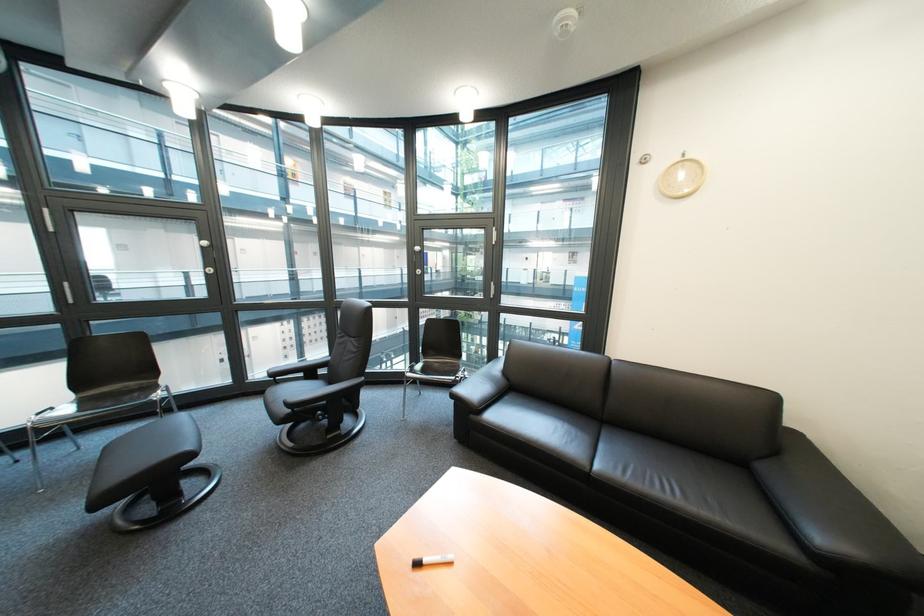
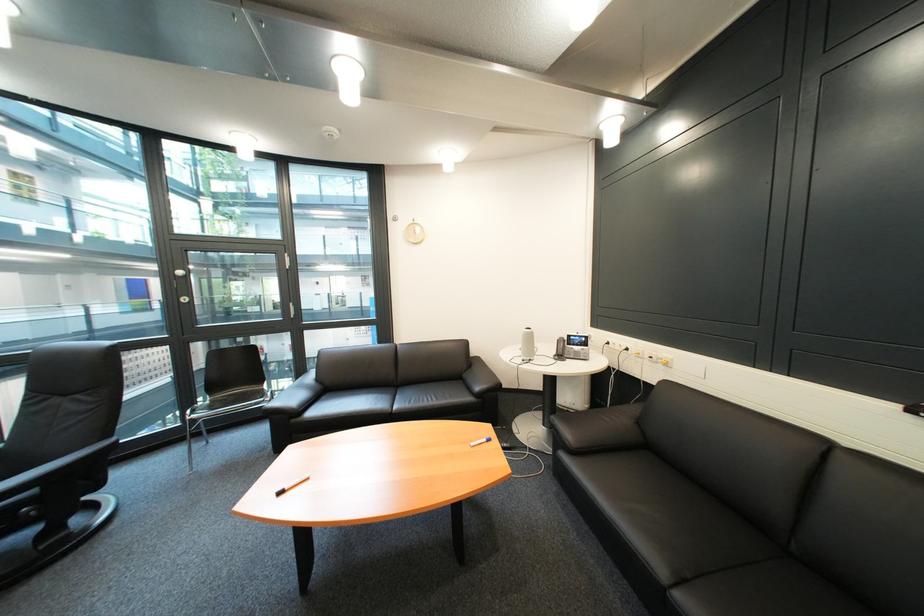
Question: How did the camera likely rotate?

Choices:
 (A) Left
 (B) Right
 (C) Up
 (D) Down

Answer: (B)